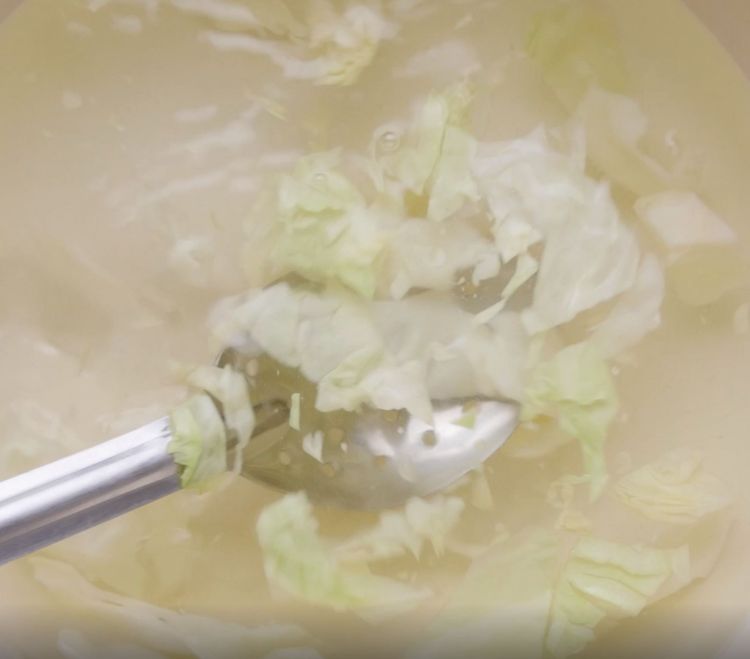
The width and height of the screenshot is (750, 659). Identify the location of rim of the bowl. (693, 13), (730, 61).